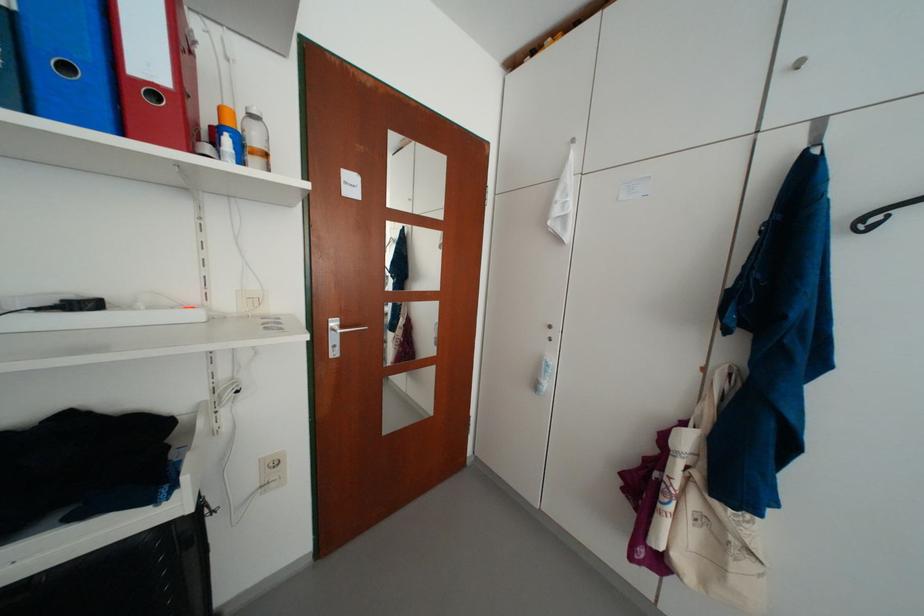
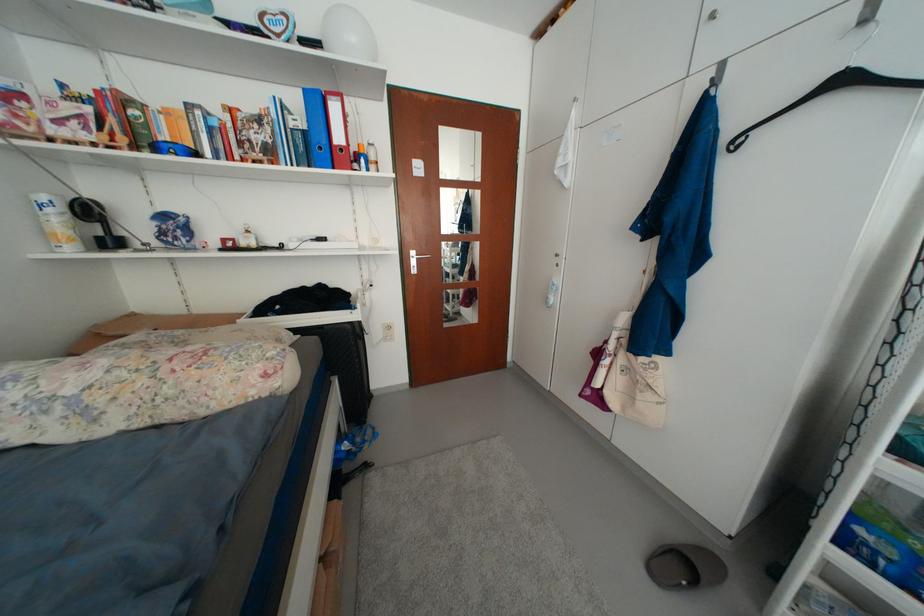
Which direction would the cameraman need to move to produce the second image?

The cameraman walked toward right, backward.